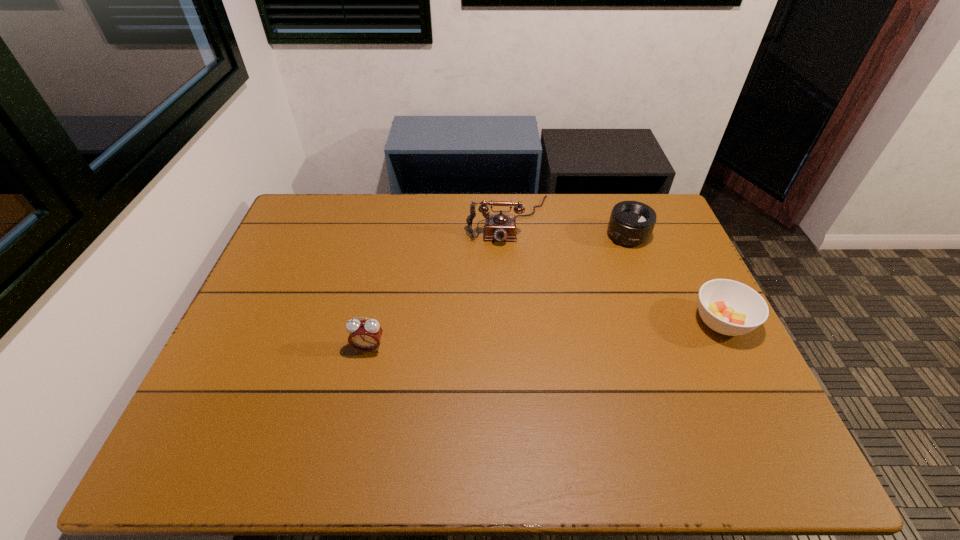
At what (x,y) coordinates should I click in order to perform the action: click on vacant space at the right edge. Please return your answer as a coordinate pair (x, y). Looking at the image, I should click on (640, 246).

Identify the location of vacant space at the far left corner of the desktop. (297, 214).

The image size is (960, 540). What are the coordinates of `empty location between the soup bowl and the leftmost object` in the screenshot? It's located at (545, 335).

The width and height of the screenshot is (960, 540). I want to click on free space between the second object from left to right and the rightmost object, so click(x=615, y=271).

Where is `vacant point located between the second object from left to right and the telephoto lens`? This screenshot has height=540, width=960. vacant point located between the second object from left to right and the telephoto lens is located at coordinates (568, 228).

Locate an element on the screen. The image size is (960, 540). free spot between the rightmost object and the telephone is located at coordinates (615, 271).

You are a GUI agent. You are given a task and a screenshot of the screen. Output one action in this format:
    pyautogui.click(x=<x>, y=<y>)
    Task: Click on the empty location between the soup bowl and the leftmost object
    The height and width of the screenshot is (540, 960).
    Given the screenshot: What is the action you would take?
    pyautogui.click(x=545, y=335)

The image size is (960, 540). In order to click on vacant point located between the telephone and the rightmost object in this screenshot , I will do `click(615, 271)`.

Identify the location of free spot between the rightmost object and the second object from left to right. (615, 271).

Identify the location of free spot between the third object from left to right and the soup bowl. (675, 279).